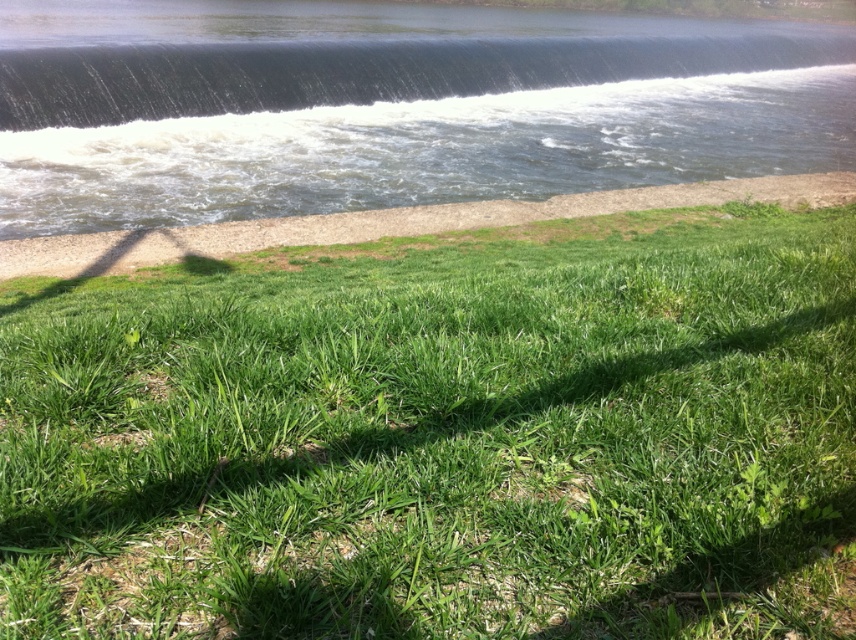
Looking at this image, you are standing at the edge of the grassy area and want to walk to the water. There are two points marked on the path leading towards the water. The first point is at coordinates point (381, 288), and the second point is at coordinates point (500, 140). Which point is closer to you as you start walking towards the water?

Point (381, 288) is closer to the viewer than point (500, 140), so the first point is closer to you as you start walking towards the water.